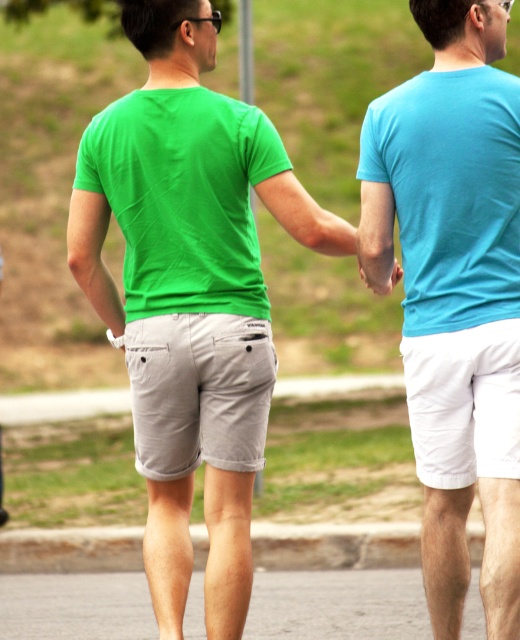
You are standing at the point with coordinates (192,337) in the image. What object is located exactly at this point?

The matte green tshirt at center is located exactly at point (192,337).